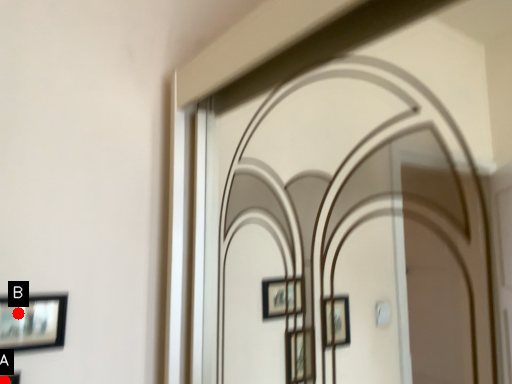
Question: Two points are circled on the image, labeled by A and B beside each circle. Which point is farther to the camera?

Choices:
 (A) A is further
 (B) B is further

Answer: (B)